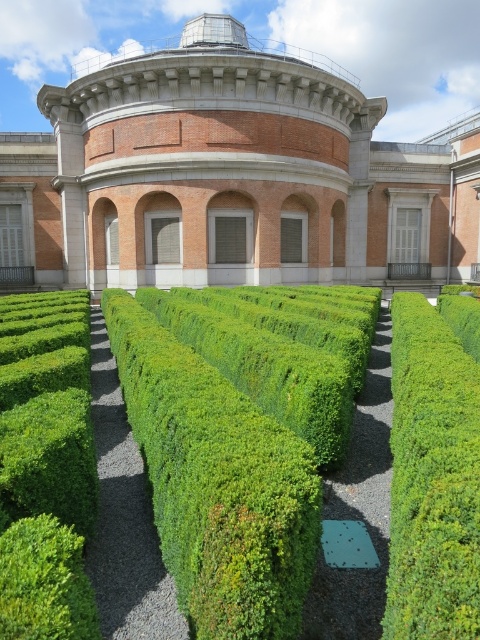
You are navigating through the hedge maze and want to reach the central point. You have two markers in the maze labeled as point [118,152] and point [54,621]. Which marker is closer to the central point of the maze?

Point [118,152] is behind point [54,621], so point [54,621] is closer to the central point of the maze.

You are a gardener planning to install a new sprinkler system in the garden. The sprinkler needs to reach the highest point between the brick wall at center and the green leafy bush at center to ensure proper watering. Which object should the sprinkler be aimed at?

The brick wall at center is taller than the green leafy bush at center, so the sprinkler should be aimed at the brick wall at center to reach the highest point.